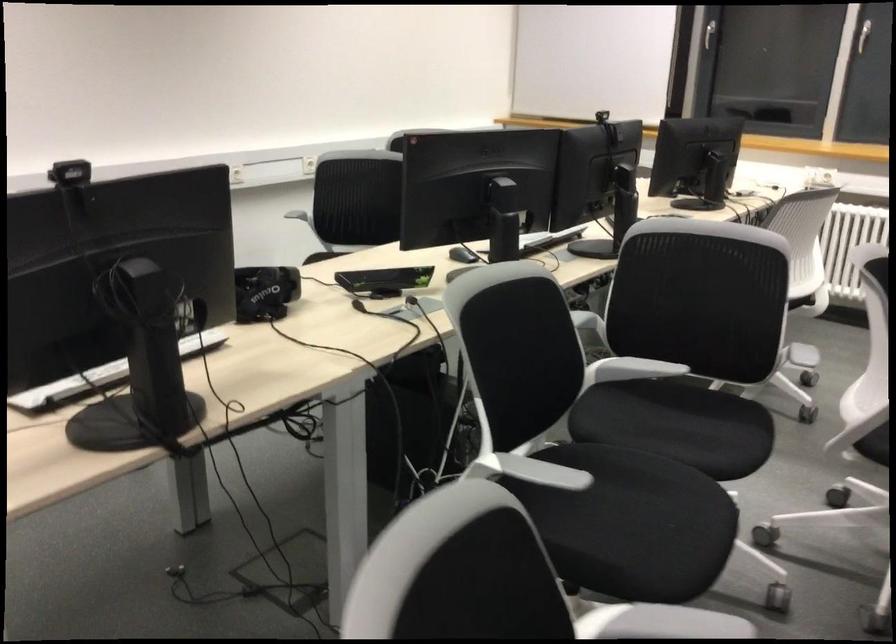
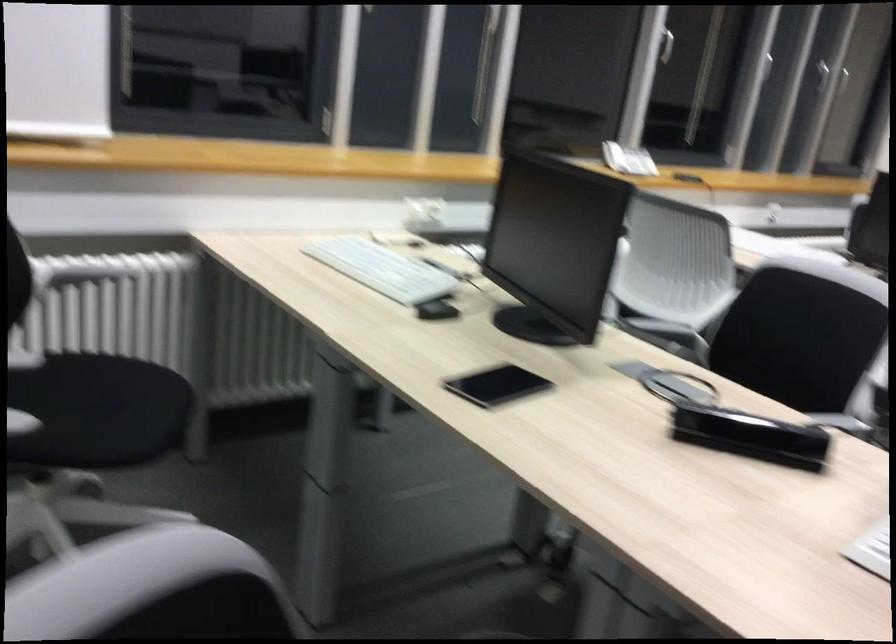
In the second image, find the point that corresponds to point 791,220 in the first image.

(798, 337)